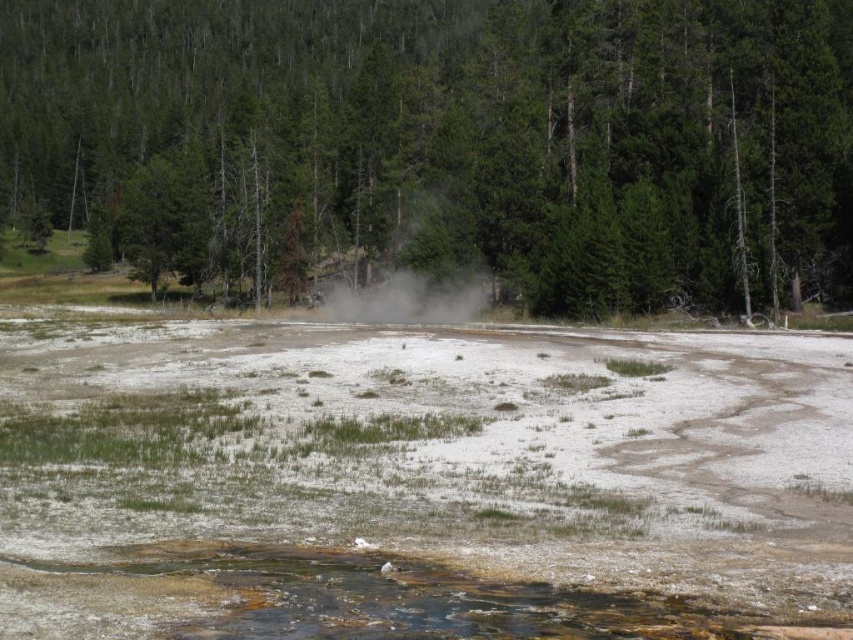
Question: Does green matte tree at center have a smaller size compared to white dusty steam at center?

Choices:
 (A) yes
 (B) no

Answer: (B)

Question: Can you confirm if white sedimentary water at center is positioned above white dusty steam at center?

Choices:
 (A) yes
 (B) no

Answer: (B)

Question: Which point is closer to the camera?

Choices:
 (A) white dusty steam at center
 (B) green matte tree at center

Answer: (B)

Question: Is white sedimentary water at center smaller than green matte tree at center?

Choices:
 (A) yes
 (B) no

Answer: (A)

Question: Estimate the real-world distances between objects in this image. Which object is closer to the white dusty steam at center?

Choices:
 (A) white sedimentary water at center
 (B) green matte tree at center

Answer: (A)

Question: Among these points, which one is nearest to the camera?

Choices:
 (A) (325, 289)
 (B) (102, 157)

Answer: (A)